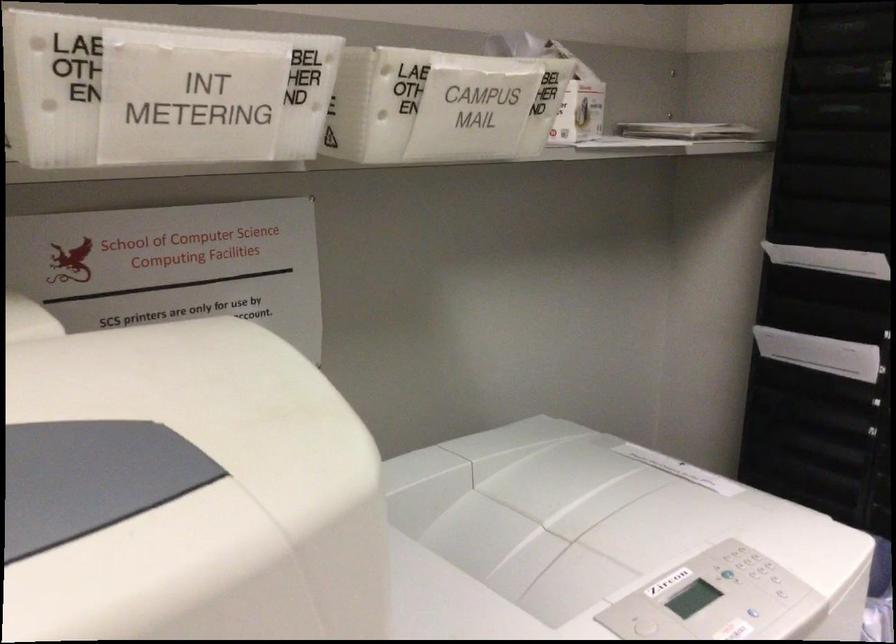
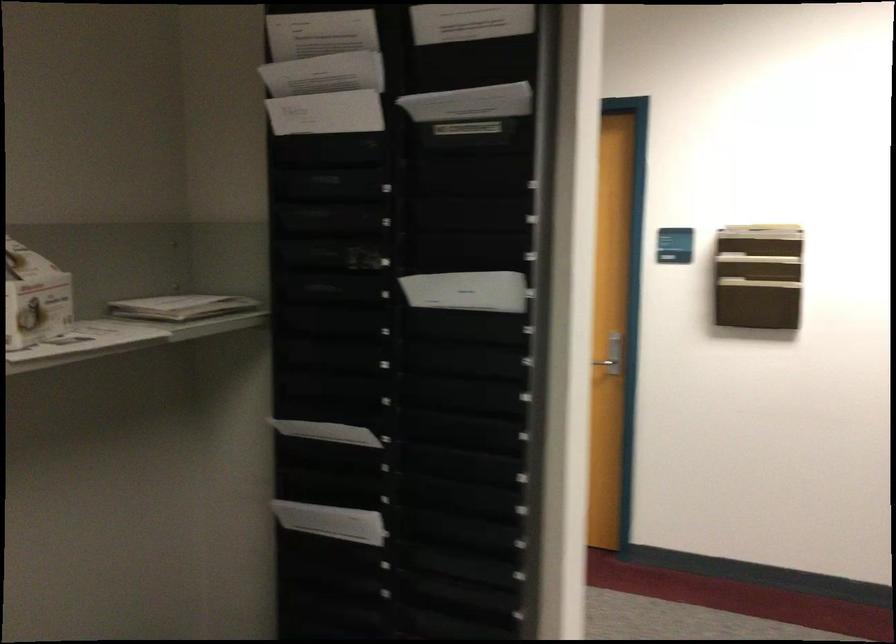
Question: The images are taken continuously from a first-person perspective. In which direction are you moving?

Choices:
 (A) Left
 (B) Right
 (C) Forward
 (D) Backward

Answer: (B)